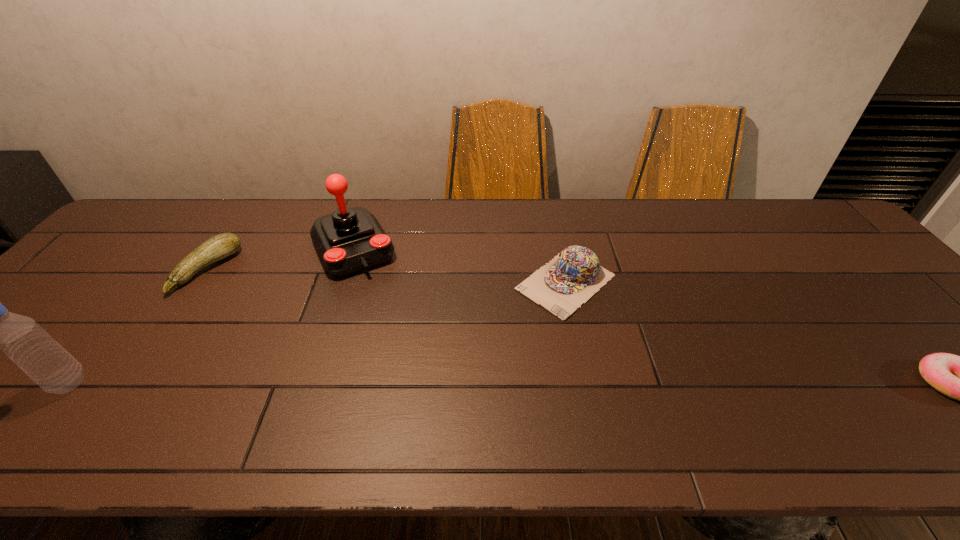
Identify the location of free location that satisfies the following two spatial constraints: 1. on the front side of the cap; 2. on the right side of the zucchini. (200, 282).

Locate an element on the screen. This screenshot has height=540, width=960. vacant area that satisfies the following two spatial constraints: 1. on the back side of the third object from right to left; 2. on the left side of the leftmost object is located at coordinates (176, 248).

Identify the location of free location that satisfies the following two spatial constraints: 1. on the back side of the bottle; 2. on the left side of the cap. [149, 282].